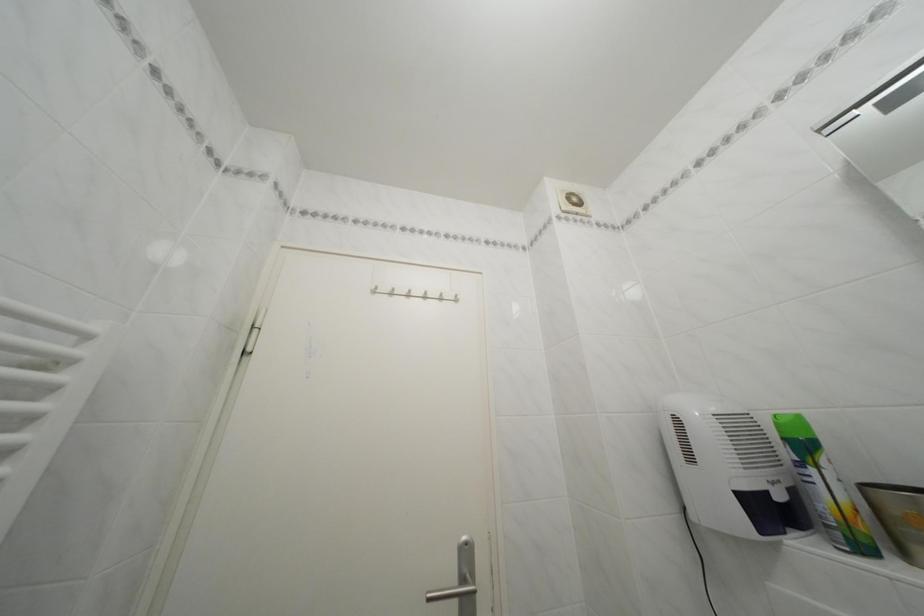
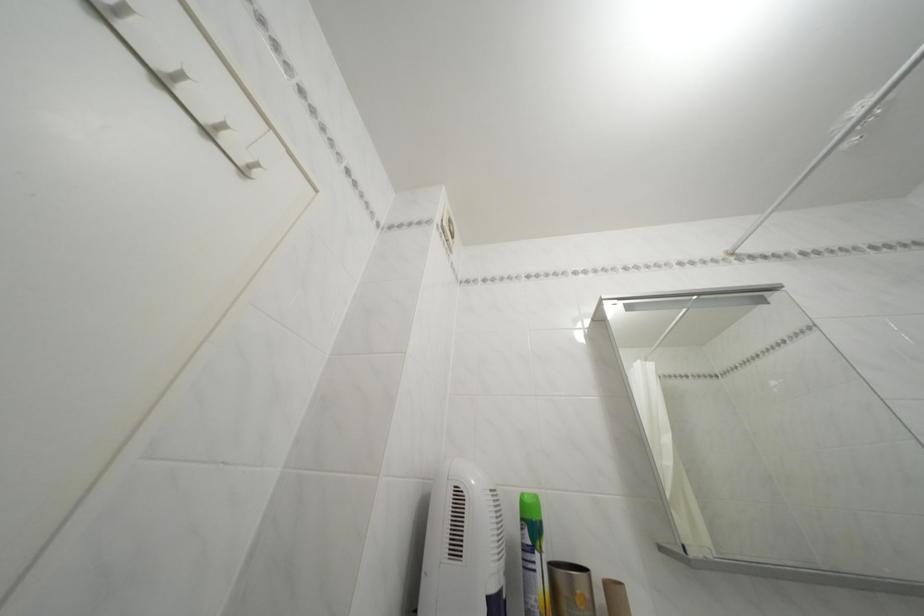
The point at (793, 445) is marked in the first image. Where is the corresponding point in the second image?

(531, 525)